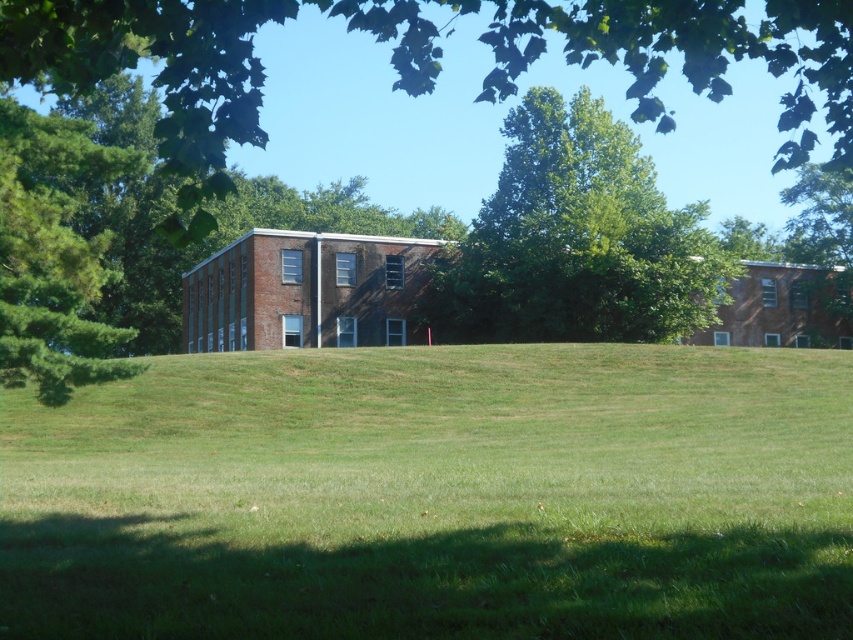
Looking at this image, you are standing in the middle of the green grass at center and want to walk towards the green leafy tree at center. Which direction should you go to reach the tree?

The green grass at center is wider than the green leafy tree at center, so you should walk towards the direction where the grass narrows to reach the tree.

You are standing at the point marked by the coordinates point (436, 497) in the image. What is the immediate surface beneath your feet?

The point (436, 497) marks green grass at center, so the immediate surface beneath your feet is green grass at center.

You are a hiker standing at the edge of the grassy field. You see the green grass at center and the green pine tree at left. Which object is closer to you?

The green grass at center is closer to you because it is in front of the green pine tree at left.